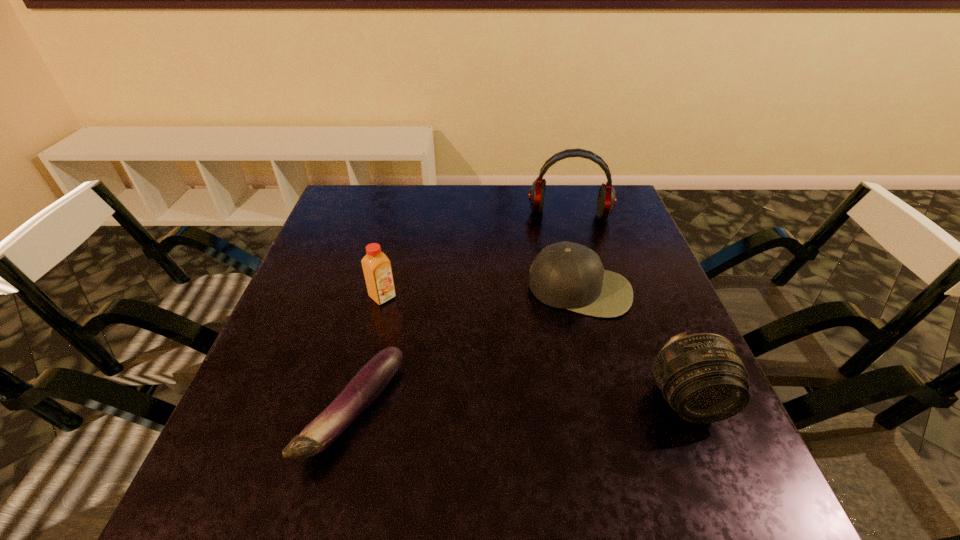
In the image, there is a desktop. At what (x,y) coordinates should I click in order to perform the action: click on free space at the near left corner. Please return your answer as a coordinate pair (x, y). The height and width of the screenshot is (540, 960). Looking at the image, I should click on (263, 429).

What are the coordinates of `blank region between the cap and the telephoto lens` in the screenshot? It's located at (635, 345).

In order to click on empty space that is in between the fourth tallest object and the eggplant in this screenshot , I will do `click(467, 350)`.

At what (x,y) coordinates should I click in order to perform the action: click on free space between the orange juice and the fourth tallest object. Please return your answer as a coordinate pair (x, y). This screenshot has height=540, width=960. Looking at the image, I should click on (481, 294).

Locate an element on the screen. This screenshot has height=540, width=960. vacant space that's between the telephoto lens and the orange juice is located at coordinates (536, 348).

In order to click on free space between the orange juice and the fourth tallest object in this screenshot , I will do `click(481, 294)`.

Find the location of a particular element. This screenshot has width=960, height=540. blank region between the second shortest object and the orange juice is located at coordinates click(481, 294).

The image size is (960, 540). I want to click on vacant space in between the cap and the telephoto lens, so click(x=635, y=345).

Point out which object is positioned as the fourth nearest to the orange juice. Please provide its 2D coordinates. Your answer should be formatted as a tuple, i.e. [(x, y)], where the tuple contains the x and y coordinates of a point satisfying the conditions above.

[(703, 377)]

Where is `object that stands as the closest to the shortest object`? object that stands as the closest to the shortest object is located at coordinates (376, 266).